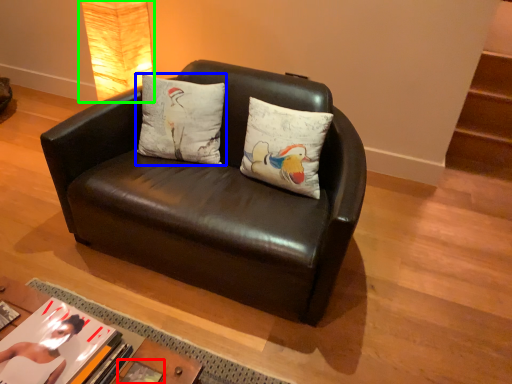
Question: Which object is positioned closest to book (highlighted by a red box)? Select from pillow (highlighted by a blue box) and lamp (highlighted by a green box).

Choices:
 (A) pillow
 (B) lamp

Answer: (A)